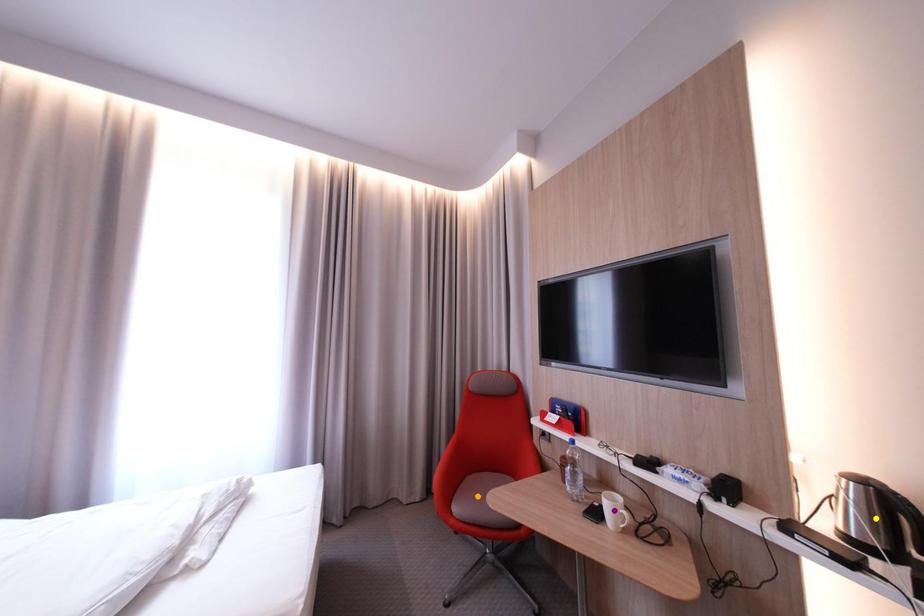
Order these from nearest to farthest:
yellow point
purple point
orange point

1. yellow point
2. purple point
3. orange point